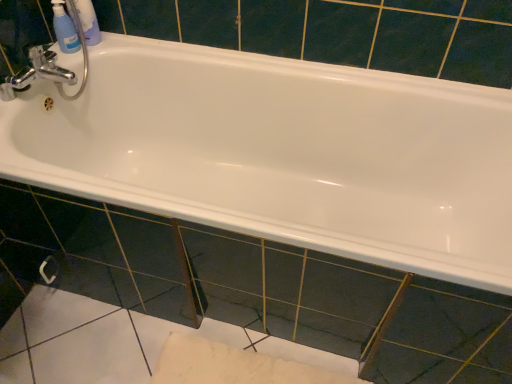
Question: Could white glossy bathtub at center be considered to be inside translucent plastic bottles at upper left?

Choices:
 (A) yes
 (B) no

Answer: (B)

Question: From a real-world perspective, is translucent plastic bottles at upper left beneath white glossy bathtub at center?

Choices:
 (A) no
 (B) yes

Answer: (A)

Question: Considering the relative sizes of translucent plastic bottles at upper left and white glossy bathtub at center in the image provided, is translucent plastic bottles at upper left bigger than white glossy bathtub at center?

Choices:
 (A) no
 (B) yes

Answer: (A)

Question: Is translucent plastic bottles at upper left shorter than white glossy bathtub at center?

Choices:
 (A) no
 (B) yes

Answer: (B)

Question: Would you say translucent plastic bottles at upper left is outside white glossy bathtub at center?

Choices:
 (A) yes
 (B) no

Answer: (A)

Question: From a real-world perspective, relative to white glossy bathtub at center, is glossy ceramic tile at center vertically above or below?

Choices:
 (A) above
 (B) below

Answer: (B)

Question: Looking at their shapes, would you say glossy ceramic tile at center is wider or thinner than white glossy bathtub at center?

Choices:
 (A) wide
 (B) thin

Answer: (B)

Question: Looking at the image, does glossy ceramic tile at center seem bigger or smaller compared to white glossy bathtub at center?

Choices:
 (A) small
 (B) big

Answer: (A)

Question: Considering the positions of glossy ceramic tile at center and white glossy bathtub at center in the image, is glossy ceramic tile at center taller or shorter than white glossy bathtub at center?

Choices:
 (A) tall
 (B) short

Answer: (B)

Question: From a real-world perspective, is glossy ceramic tile at center positioned above or below chrome metallic faucet at upper left?

Choices:
 (A) above
 (B) below

Answer: (B)

Question: Considering their positions, is glossy ceramic tile at center located in front of or behind chrome metallic faucet at upper left?

Choices:
 (A) behind
 (B) front

Answer: (B)

Question: Considering the positions of glossy ceramic tile at center and chrome metallic faucet at upper left in the image, is glossy ceramic tile at center wider or thinner than chrome metallic faucet at upper left?

Choices:
 (A) thin
 (B) wide

Answer: (A)

Question: Is glossy ceramic tile at center to the left or to the right of chrome metallic faucet at upper left in the image?

Choices:
 (A) right
 (B) left

Answer: (A)

Question: From the image's perspective, relative to translucent plastic bottles at upper left, is silver metallic towel bar at lower left above or below?

Choices:
 (A) above
 (B) below

Answer: (B)

Question: In terms of size, does silver metallic towel bar at lower left appear bigger or smaller than translucent plastic bottles at upper left?

Choices:
 (A) big
 (B) small

Answer: (B)